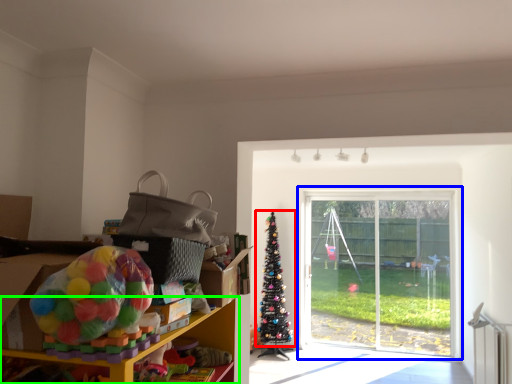
Question: Based on their relative distances, which object is farther from christmas tree (highlighted by a red box)? Choose from window (highlighted by a blue box) and shelf (highlighted by a green box).

Choices:
 (A) window
 (B) shelf

Answer: (B)